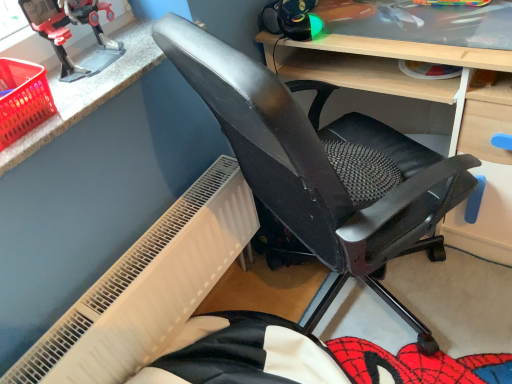
What are the coordinates of `vacant area that is in front of metallic plastic toy robot at upper left` in the screenshot? It's located at (93, 92).